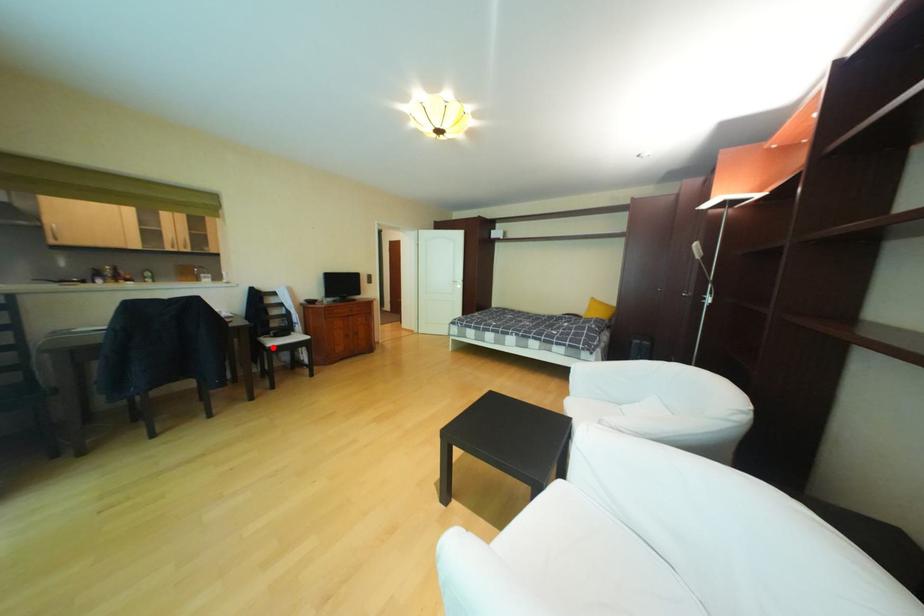
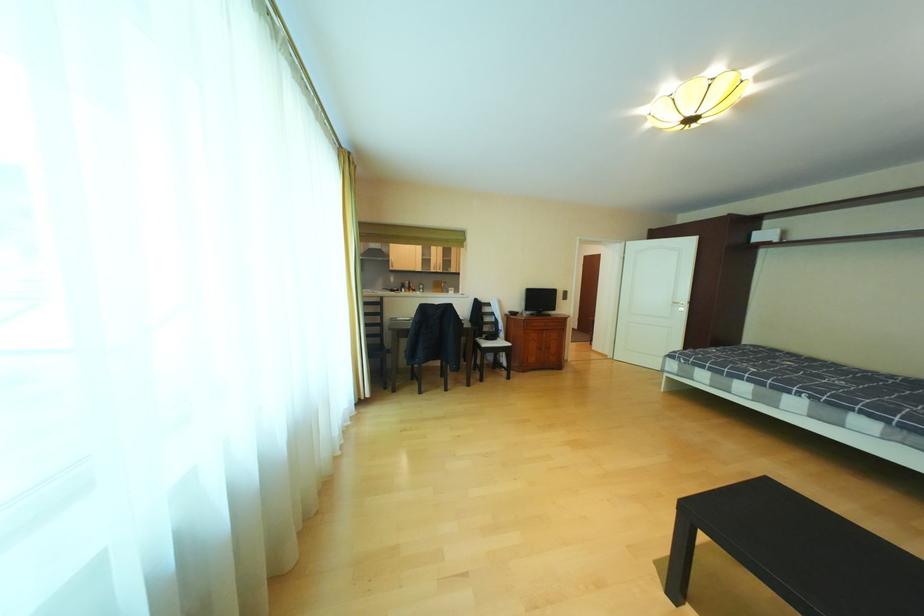
Question: I am providing you with two images of the same scene from different viewpoints. A red point is marked on the first image. At the location where the point appears in image 1, is it still visible in image 2?

Choices:
 (A) Yes
 (B) No

Answer: (A)